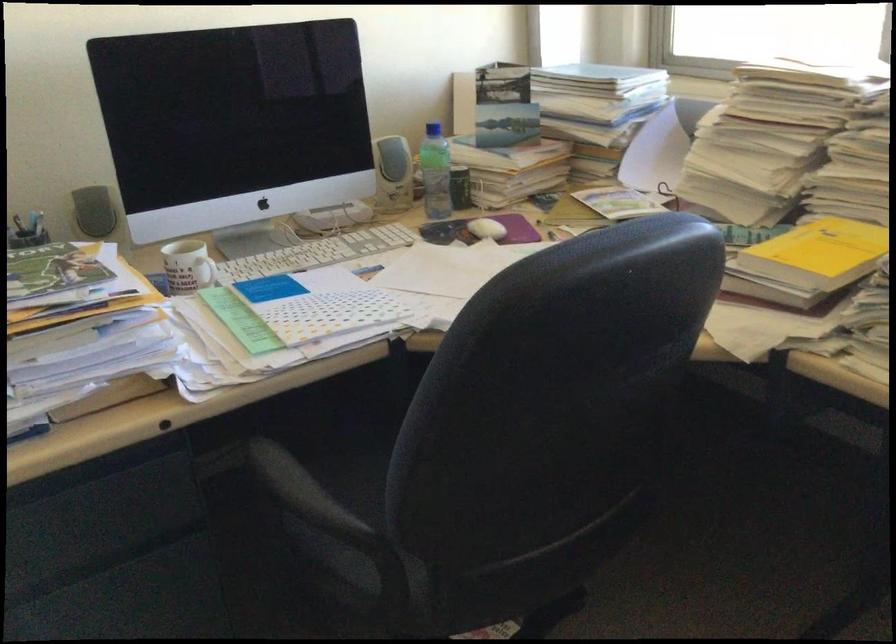
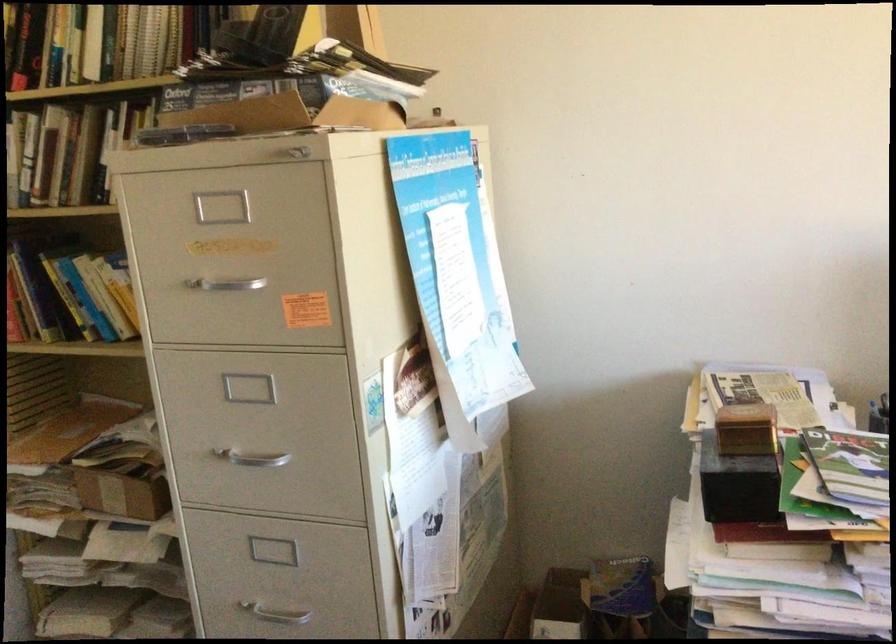
Question: The camera is either moving clockwise (left) or counter-clockwise (right) around the object. The first image is from the beginning of the video and the second image is from the end. Is the camera moving left or right when shooting the video?

Choices:
 (A) Left
 (B) Right

Answer: (B)